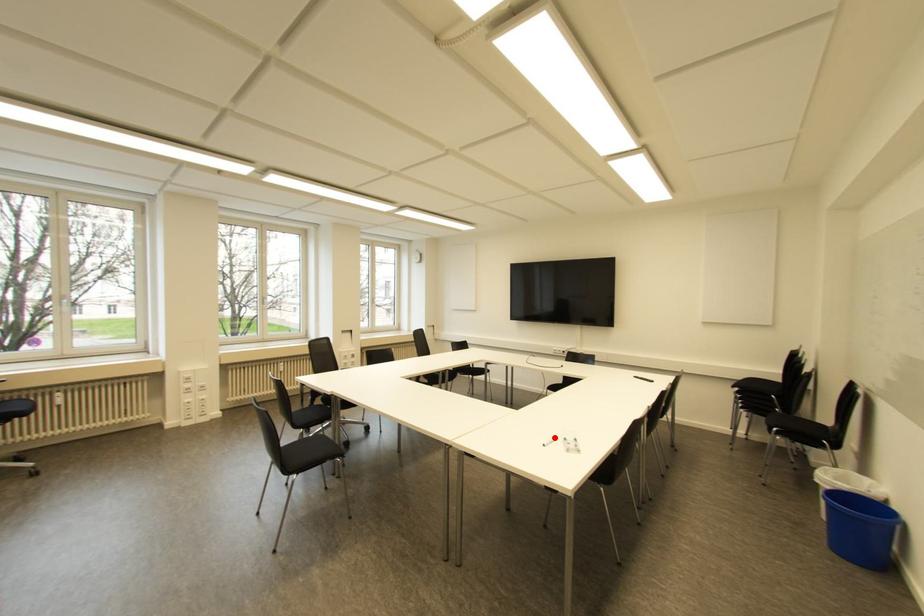
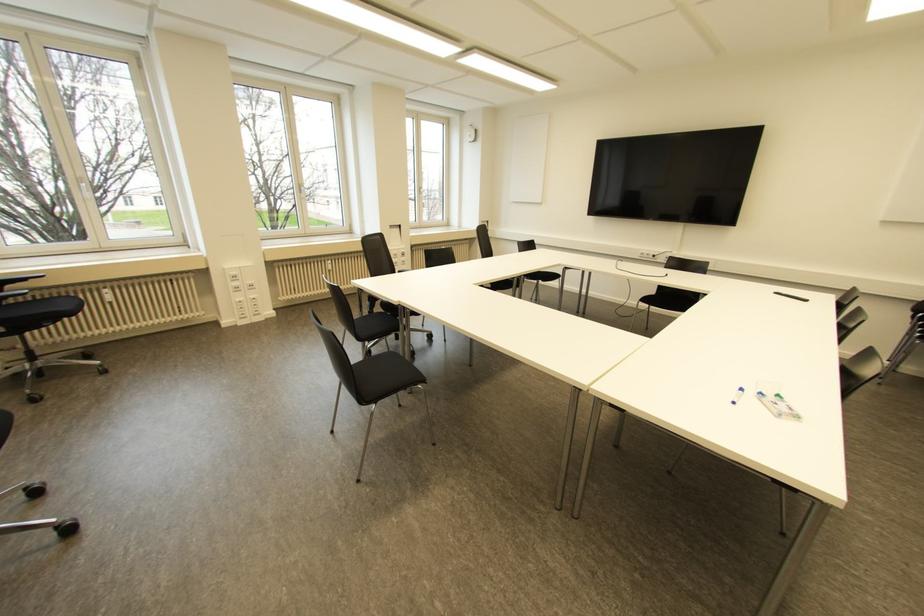
Question: I am providing you with two images of the same scene from different viewpoints. A red point is shown in image1. For the corresponding object point in image2, is it positioned nearer or farther from the camera?

Choices:
 (A) Nearer
 (B) Farther

Answer: (B)